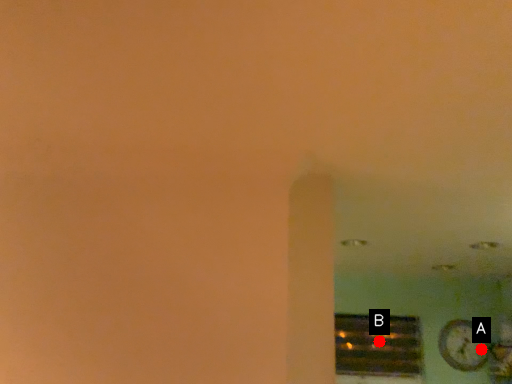
Question: Two points are circled on the image, labeled by A and B beside each circle. Which point is closer to the camera?

Choices:
 (A) A is closer
 (B) B is closer

Answer: (A)